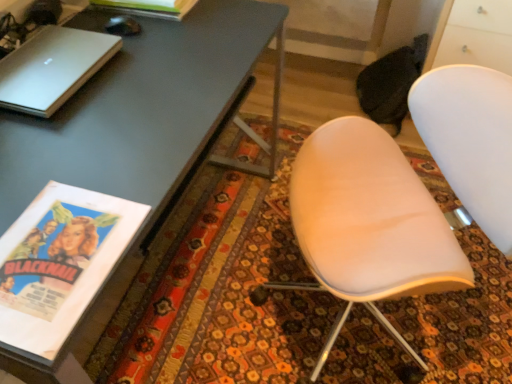
Locate an element on the screen. The image size is (512, 384). free space to the back side of black glossy mouse at upper left is located at coordinates (131, 17).